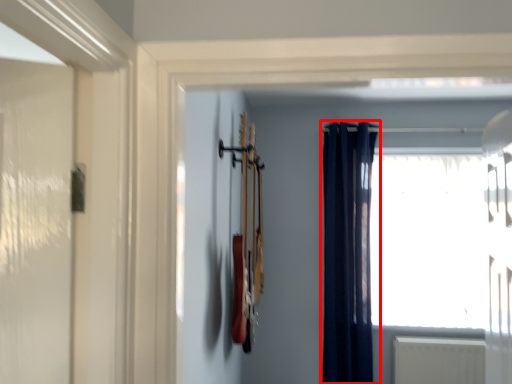
Question: From the image, what is the correct spatial relationship of curtain (annotated by the red box) in relation to window?

Choices:
 (A) left
 (B) right

Answer: (A)